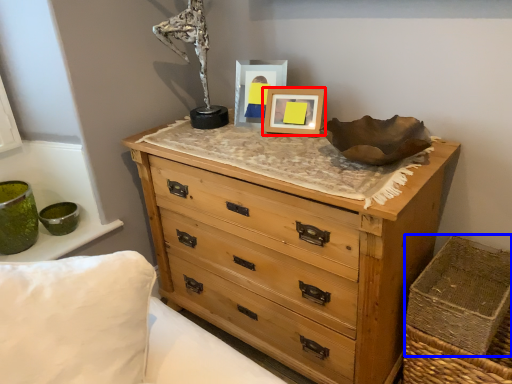
Question: Which object appears closest to the camera in this image, picture frame (highlighted by a red box) or crate (highlighted by a blue box)?

Choices:
 (A) picture frame
 (B) crate

Answer: (B)